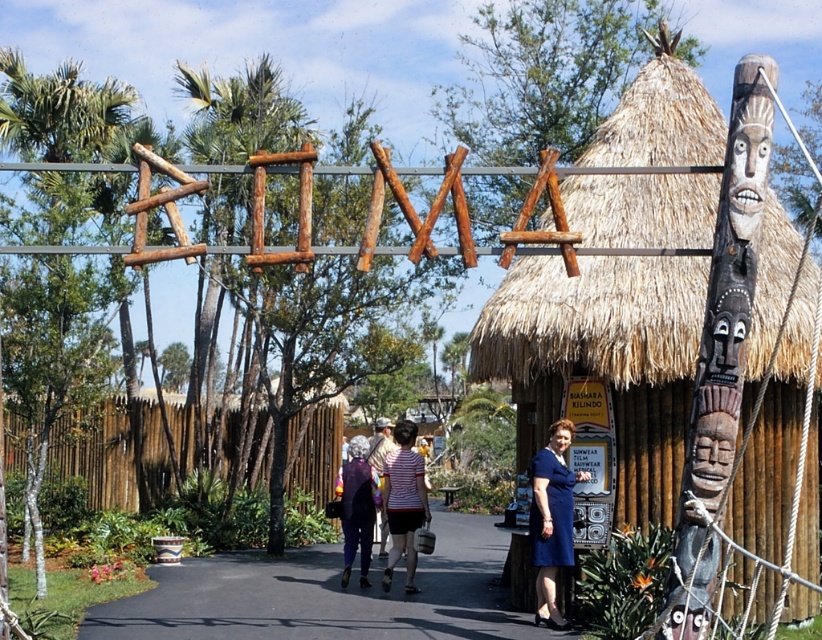
Question: Which point is farther to the camera?

Choices:
 (A) striped cotton shirt at center
 (B) dark brown wood totem pole at right
 (C) blue fabric dress at center

Answer: (A)

Question: Among these points, which one is farthest from the camera?

Choices:
 (A) (690, 422)
 (B) (585, 477)

Answer: (B)

Question: Does green leafy palm tree at left have a smaller size compared to striped cotton shirt at center?

Choices:
 (A) no
 (B) yes

Answer: (A)

Question: Is striped cotton shirt at center below dark purple fabric dress at center?

Choices:
 (A) no
 (B) yes

Answer: (A)

Question: In this image, where is striped cotton shirt at center located relative to dark purple fabric dress at center?

Choices:
 (A) above
 (B) below

Answer: (A)

Question: Which object is positioned closest to the asphalt pathway at center?

Choices:
 (A) green leafy palm tree at left
 (B) thatched straw hut at center
 (C) dark brown wood totem pole at right

Answer: (A)